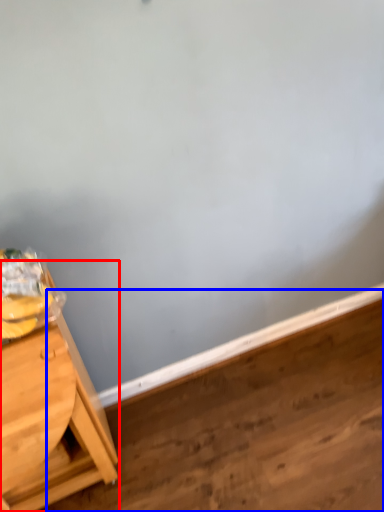
Question: Which object is closer to the camera taking this photo, table (highlighted by a red box) or plywood (highlighted by a blue box)?

Choices:
 (A) table
 (B) plywood

Answer: (A)